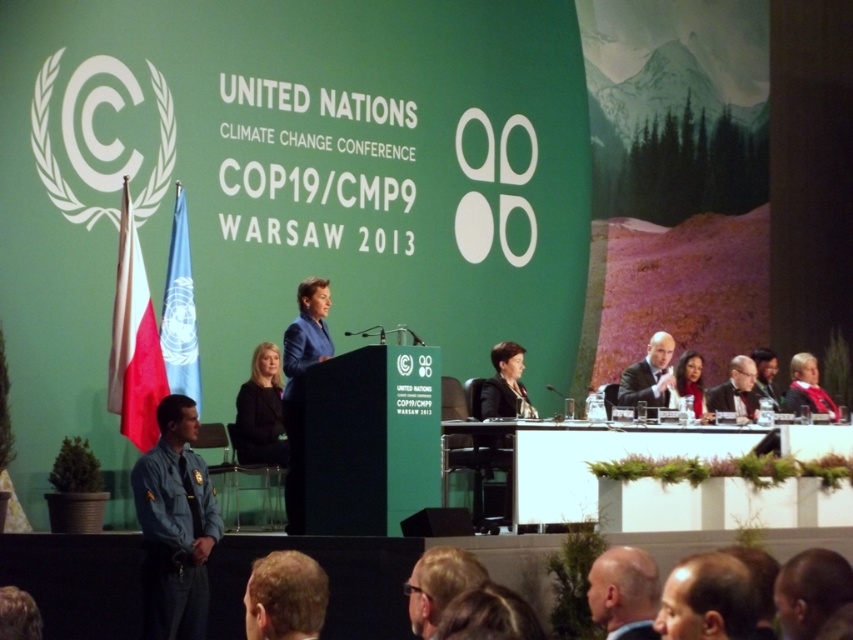
You are a photographer at the COP19 conference. You need to capture a portrait of the speaker that includes both the blonde hair at lower center and the smooth skin face at center. Which object should you focus on to ensure both are in frame?

You should focus on the smooth skin face at center because it occupies more space than the blonde hair at lower center, making it easier to include both in the frame.

Consider the image. You are attending the United Nations Climate Change Conference and notice the blue fabric flag at left and the bald head at lower center in the image. Which object appears higher in the scene?

The blue fabric flag at left is positioned over the bald head at lower center, so it appears higher in the scene.

You are a photographer standing at the back of the conference hall. You want to take a photo of the woman in the matte black suit at right and the UN logo in the background. How far apart are these two elements in the image?

The matte black suit at right and the UN logo in the background are 36.13 meters apart.